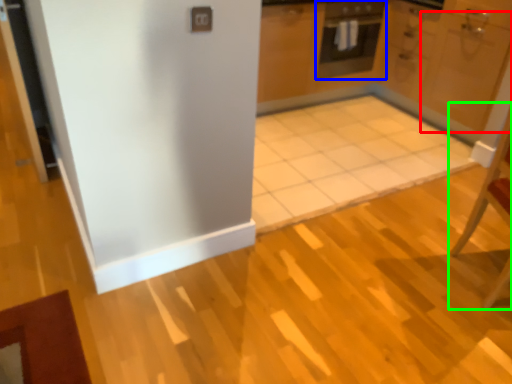
Question: Which object is the closest to the door (highlighted by a red box)? Choose among these: oven (highlighted by a blue box) or chair (highlighted by a green box).

Choices:
 (A) oven
 (B) chair

Answer: (A)